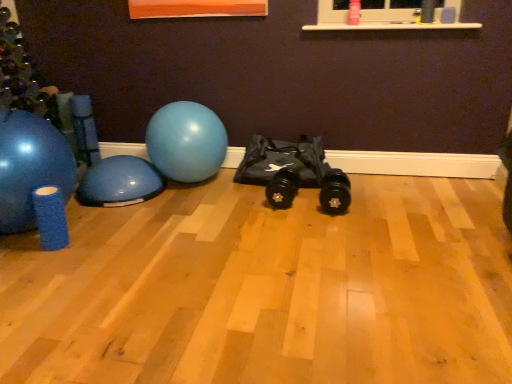
Question: Is matte blue exercise ball at left, arranged as the first ball when viewed from the left, positioned behind blue rubber ball at left, the second ball when ordered from right to left?

Choices:
 (A) no
 (B) yes

Answer: (A)

Question: Considering the relative sizes of matte blue exercise ball at left, which is the third ball in right-to-left order, and blue rubber ball at left, which ranks as the 2th ball in left-to-right order, in the image provided, is matte blue exercise ball at left, which is the third ball in right-to-left order, smaller than blue rubber ball at left, which ranks as the 2th ball in left-to-right order,?

Choices:
 (A) no
 (B) yes

Answer: (A)

Question: From a real-world perspective, is matte blue exercise ball at left, which is the third ball in right-to-left order, on blue rubber ball at left, the second ball when ordered from right to left?

Choices:
 (A) no
 (B) yes

Answer: (B)

Question: Does matte blue exercise ball at left, arranged as the first ball when viewed from the left, touch blue rubber ball at left, which ranks as the 2th ball in left-to-right order?

Choices:
 (A) yes
 (B) no

Answer: (B)

Question: From the image's perspective, does matte blue exercise ball at left, arranged as the first ball when viewed from the left, appear higher than blue rubber ball at left, the second ball when ordered from right to left?

Choices:
 (A) yes
 (B) no

Answer: (A)

Question: From a real-world perspective, is matte blue exercise ball at left, arranged as the first ball when viewed from the left, positioned above or below blue rubber ball at left, the second ball when ordered from right to left?

Choices:
 (A) below
 (B) above

Answer: (B)

Question: From their relative heights in the image, would you say matte blue exercise ball at left, which is the third ball in right-to-left order, is taller or shorter than blue rubber ball at left, which ranks as the 2th ball in left-to-right order?

Choices:
 (A) tall
 (B) short

Answer: (A)

Question: Is point (38, 142) positioned closer to the camera than point (141, 200)?

Choices:
 (A) farther
 (B) closer

Answer: (B)

Question: In terms of size, does matte blue exercise ball at left, which is the third ball in right-to-left order, appear bigger or smaller than blue rubber ball at left, the second ball when ordered from right to left?

Choices:
 (A) big
 (B) small

Answer: (A)

Question: From a real-world perspective, is blue rubber ball at left, the second ball when ordered from right to left, above or below glossy rubber ball at center, the first ball when ordered from right to left?

Choices:
 (A) above
 (B) below

Answer: (B)

Question: Considering the positions of point (111, 190) and point (163, 132), is point (111, 190) closer or farther from the camera than point (163, 132)?

Choices:
 (A) farther
 (B) closer

Answer: (B)

Question: Based on their positions, is blue rubber ball at left, which ranks as the 2th ball in left-to-right order, located to the left or right of glossy rubber ball at center, which is the 3th ball in left-to-right order?

Choices:
 (A) left
 (B) right

Answer: (A)

Question: From the image's perspective, is blue rubber ball at left, the second ball when ordered from right to left, above or below glossy rubber ball at center, the first ball when ordered from right to left?

Choices:
 (A) below
 (B) above

Answer: (A)

Question: In the image, is blue rubber ball at left, the second ball when ordered from right to left, positioned in front of or behind matte blue exercise ball at left, arranged as the first ball when viewed from the left?

Choices:
 (A) front
 (B) behind

Answer: (B)

Question: Is blue rubber ball at left, the second ball when ordered from right to left, bigger or smaller than matte blue exercise ball at left, which is the third ball in right-to-left order?

Choices:
 (A) big
 (B) small

Answer: (B)